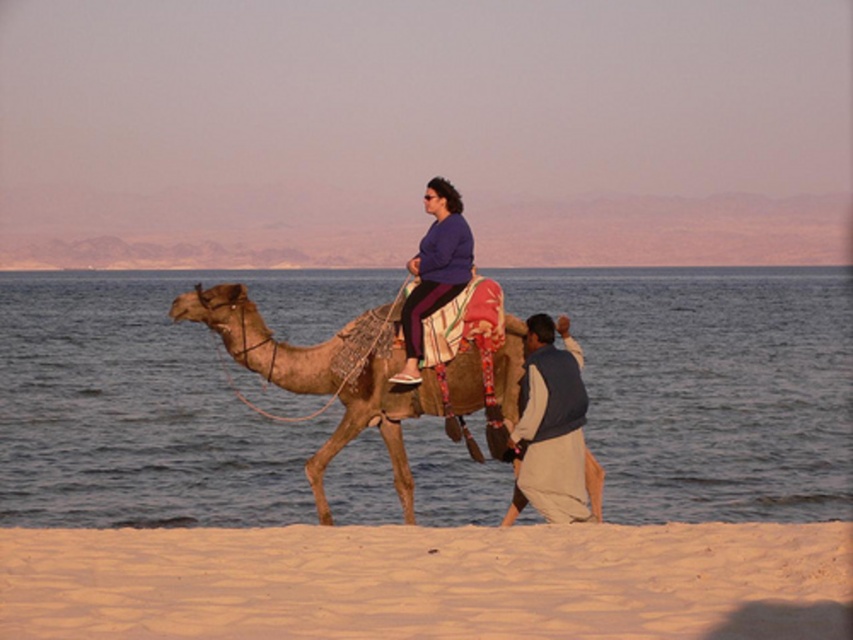
In the scene shown: You are a traveler planning to walk from the smooth sand at lower center to the beige cotton pants at lower right. Which object will you step on first?

The smooth sand at lower center is larger in size than the beige cotton pants at lower right, so you will step on the smooth sand at lower center first.

You are standing at the edge of the desert and see the sandy beige at lower center and the brown textured camel at center. Which object is closer to you?

The sandy beige at lower center is closer to the viewer than the brown textured camel at center.

You are planning to take a photo of the sandy beige at lower center and the brown textured camel at center in the desert scene. Which object should you focus on first if you want to capture both in a single shot without moving the camera?

The sandy beige at lower center has a smaller size compared to the brown textured camel at center, so you should focus on the brown textured camel at center first to ensure it is in focus while the smaller sandy beige at lower center remains within the frame.